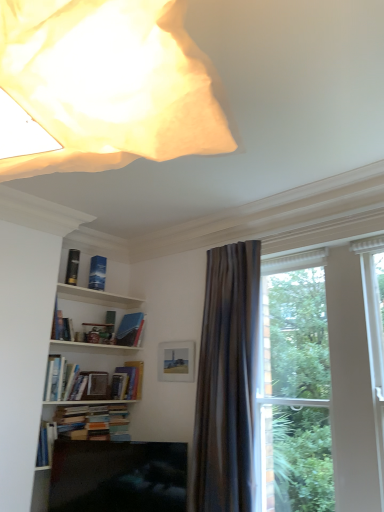
Question: Is hardcover books at lower left, marked as the 1th book in a bottom-to-top arrangement, wider than metallic gold bookshelf at upper left, which is counted as the 1th book, starting from the top?

Choices:
 (A) no
 (B) yes

Answer: (B)

Question: Is metallic gold bookshelf at upper left, which is counted as the 1th book, starting from the top, a part of hardcover books at lower left, positioned as the 5th book in top-to-bottom order?

Choices:
 (A) yes
 (B) no

Answer: (B)

Question: From the image's perspective, is hardcover books at lower left, marked as the 1th book in a bottom-to-top arrangement, over metallic gold bookshelf at upper left, which is counted as the 1th book, starting from the top?

Choices:
 (A) yes
 (B) no

Answer: (B)

Question: Is hardcover books at lower left, marked as the 1th book in a bottom-to-top arrangement, far away from metallic gold bookshelf at upper left, positioned as the fifth book in bottom-to-top order?

Choices:
 (A) no
 (B) yes

Answer: (B)

Question: From a real-world perspective, is hardcover books at lower left, positioned as the 5th book in top-to-bottom order, positioned under metallic gold bookshelf at upper left, which is counted as the 1th book, starting from the top, based on gravity?

Choices:
 (A) yes
 (B) no

Answer: (A)

Question: Considering the relative sizes of hardcover books at lower left, marked as the 1th book in a bottom-to-top arrangement, and metallic gold bookshelf at upper left, positioned as the fifth book in bottom-to-top order, in the image provided, is hardcover books at lower left, marked as the 1th book in a bottom-to-top arrangement, shorter than metallic gold bookshelf at upper left, positioned as the fifth book in bottom-to-top order,?

Choices:
 (A) yes
 (B) no

Answer: (A)

Question: Is blue matte book at upper center, which is the 3th book in top-to-bottom order, turned away from hardcover books at lower left, positioned as the 5th book in top-to-bottom order?

Choices:
 (A) no
 (B) yes

Answer: (A)

Question: Is blue matte book at upper center, the 3th book in the bottom-to-top sequence, at the right side of hardcover books at lower left, positioned as the 5th book in top-to-bottom order?

Choices:
 (A) no
 (B) yes

Answer: (B)

Question: Is blue matte book at upper center, which is the 3th book in top-to-bottom order, further to the viewer compared to hardcover books at lower left, positioned as the 5th book in top-to-bottom order?

Choices:
 (A) no
 (B) yes

Answer: (B)

Question: Does blue matte book at upper center, which is the 3th book in top-to-bottom order, have a lesser height compared to hardcover books at lower left, marked as the 1th book in a bottom-to-top arrangement?

Choices:
 (A) yes
 (B) no

Answer: (B)

Question: Could you tell me if blue matte book at upper center, which is the 3th book in top-to-bottom order, is turned towards hardcover books at lower left, positioned as the 5th book in top-to-bottom order?

Choices:
 (A) yes
 (B) no

Answer: (B)

Question: Can you confirm if blue matte book at upper center, which is the 3th book in top-to-bottom order, is wider than hardcover books at lower left, marked as the 1th book in a bottom-to-top arrangement?

Choices:
 (A) yes
 (B) no

Answer: (A)

Question: Is metallic gold bookshelf at upper left, positioned as the fifth book in bottom-to-top order, completely or partially inside hardcover book at center, which appears as the second book when ordered from the bottom?

Choices:
 (A) no
 (B) yes

Answer: (A)